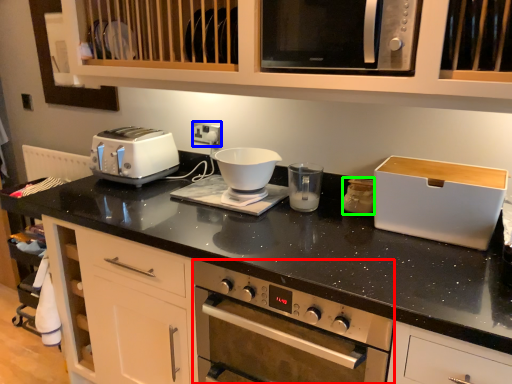
Question: Considering the real-world distances, which object is closest to home appliance (highlighted by a red box)? electric outlet (highlighted by a blue box) or appliance (highlighted by a green box).

Choices:
 (A) electric outlet
 (B) appliance

Answer: (B)